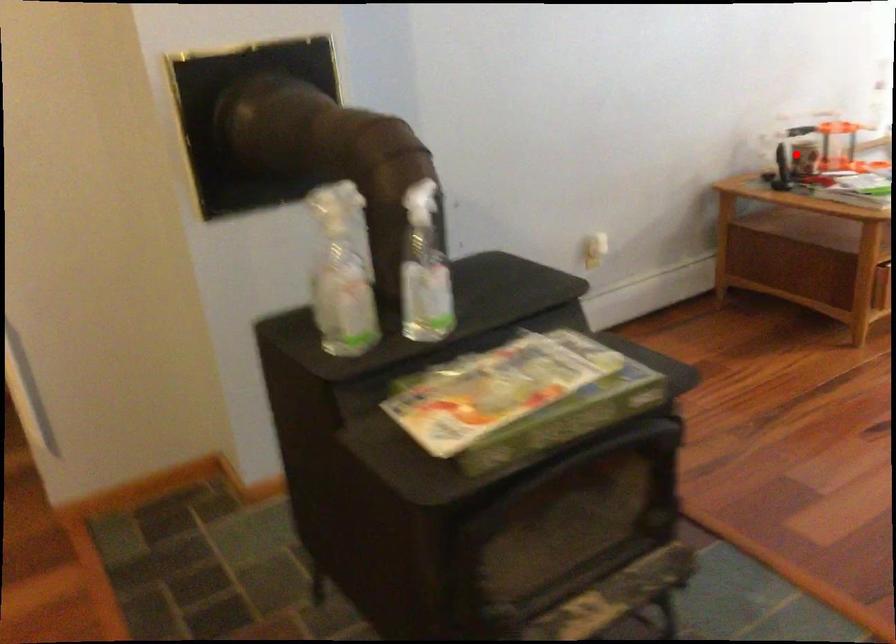
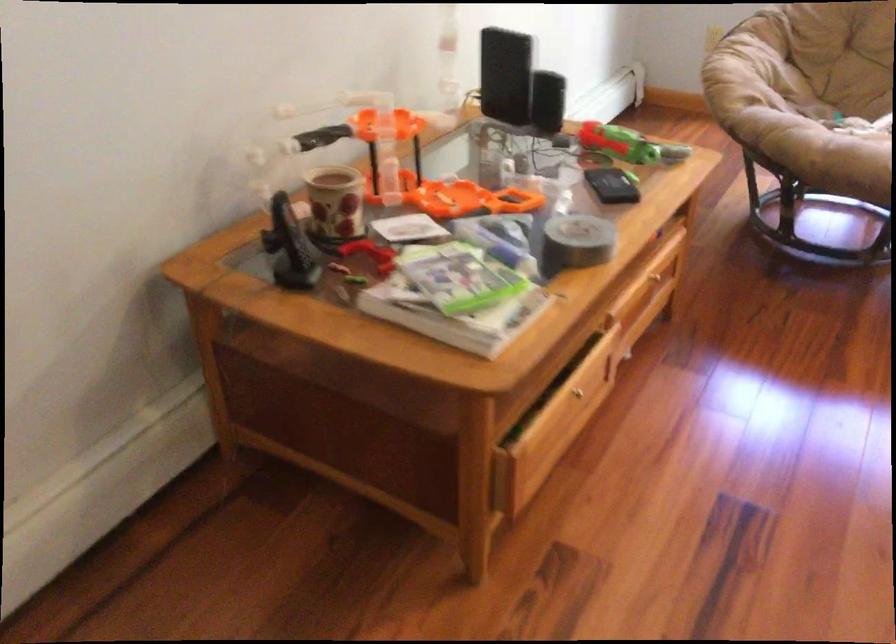
Where in the second image is the point corresponding to the highlighted location from the first image?

(334, 203)